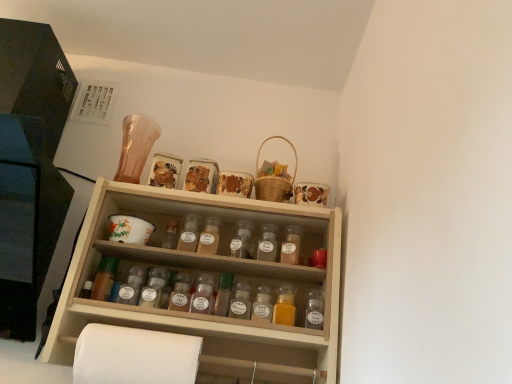
Measure the distance between point (38, 222) and camera.

The depth of point (38, 222) is 1.04 meters.

Measure the distance between white paper at lower left and camera.

white paper at lower left and camera are 35.61 inches apart.

Measure the distance between translucent plastic spice jar at center, which is the 4th bottle from left to right, and camera.

translucent plastic spice jar at center, which is the 4th bottle from left to right, and camera are 3.82 feet apart from each other.

Based on the photo, measure the distance between green glass bottle at center, placed as the first bottle when sorted from left to right, and camera.

The depth of green glass bottle at center, placed as the first bottle when sorted from left to right, is 3.46 feet.

You are a GUI agent. You are given a task and a screenshot of the screen. Output one action in this format:
    pyautogui.click(x=<x>, y=<y>)
    Task: Click on the woven brown basket at upper right
    The image size is (512, 384).
    Given the screenshot: What is the action you would take?
    pyautogui.click(x=274, y=180)

Is white paper at lower left facing towards translucent glass spice jar at center, which is the sixth bottle in right-to-left order?

No.

Is translucent glass spice jar at center, which is the sixth bottle in right-to-left order, completely or partially inside white paper at lower left?

No, translucent glass spice jar at center, which is the sixth bottle in right-to-left order, is located outside of white paper at lower left.

Consider the image. What's the angular difference between white paper at lower left and translucent glass spice jar at center, which is the sixth bottle in right-to-left order,'s facing directions?

The angular difference between white paper at lower left and translucent glass spice jar at center, which is the sixth bottle in right-to-left order, is 0.00209 degrees.

From a real-world perspective, does white paper at lower left stand above translucent glass spice jar at center, marked as the second bottle in a left-to-right arrangement?

Actually, white paper at lower left is physically below translucent glass spice jar at center, marked as the second bottle in a left-to-right arrangement, in the real world.

From a real-world perspective, is wooden spice rack at left under woven brown basket at upper right?

Yes, from a real-world perspective, wooden spice rack at left is below woven brown basket at upper right.

Is wooden spice rack at left not near woven brown basket at upper right?

wooden spice rack at left is near woven brown basket at upper right, not far away.

Which is in front, wooden spice rack at left or woven brown basket at upper right?

wooden spice rack at left is more forward.

In terms of height, does wooden spice rack at center look taller or shorter compared to translucent glass spice jar at center, the third bottle in the right-to-left sequence?

Considering their sizes, wooden spice rack at center has more height than translucent glass spice jar at center, the third bottle in the right-to-left sequence.

Is wooden spice rack at center situated inside translucent glass spice jar at center, the third bottle in the right-to-left sequence, or outside?

wooden spice rack at center cannot be found inside translucent glass spice jar at center, the third bottle in the right-to-left sequence.

Could you tell me if wooden spice rack at center is facing translucent glass spice jar at center, the fifth bottle positioned from the left?

Yes.

Locate an element on the screen. the 5th bottle behind the wooden spice rack at center, starting your count from the anchor is located at coordinates (267, 243).

From the image's perspective, which is below, translucent glass spice jar at center, the third bottle in the right-to-left sequence, or translucent plastic spice jar at center, positioned as the first bottle in right-to-left order?

translucent glass spice jar at center, the third bottle in the right-to-left sequence, is shown below in the image.

Is the surface of translucent glass spice jar at center, the third bottle in the right-to-left sequence, in direct contact with translucent plastic spice jar at center, positioned as the first bottle in right-to-left order?

Yes, translucent glass spice jar at center, the third bottle in the right-to-left sequence, is with translucent plastic spice jar at center, positioned as the first bottle in right-to-left order.

In the image, is translucent glass spice jar at center, the fifth bottle positioned from the left, positioned in front of or behind translucent plastic spice jar at center, positioned as the first bottle in right-to-left order?

translucent glass spice jar at center, the fifth bottle positioned from the left, is behind translucent plastic spice jar at center, positioned as the first bottle in right-to-left order.

Does translucent glass spice jar at center, the third bottle in the right-to-left sequence, have a greater width compared to translucent plastic spice jar at center, positioned as the first bottle in right-to-left order?

Incorrect, the width of translucent glass spice jar at center, the third bottle in the right-to-left sequence, does not surpass that of translucent plastic spice jar at center, positioned as the first bottle in right-to-left order.

You are a GUI agent. You are given a task and a screenshot of the screen. Output one action in this format:
    pyautogui.click(x=<x>, y=<y>)
    Task: Click on the 1st bottle counting from the left side of the translucent glass spice jar at center, the third bottle in the right-to-left sequence
    This screenshot has height=384, width=512.
    Given the screenshot: What is the action you would take?
    pyautogui.click(x=242, y=240)

Considering the relative positions of translucent plastic spice jar at center, which is the 4th bottle from left to right, and translucent glass spice jar at center, the third bottle in the right-to-left sequence, in the image provided, is translucent plastic spice jar at center, which is the 4th bottle from left to right, to the left or to the right of translucent glass spice jar at center, the third bottle in the right-to-left sequence,?

translucent plastic spice jar at center, which is the 4th bottle from left to right, is to the left of translucent glass spice jar at center, the third bottle in the right-to-left sequence.

Consider the image. Is translucent plastic spice jar at center, which is the 4th bottle from left to right, with translucent glass spice jar at center, the third bottle in the right-to-left sequence?

Yes, translucent plastic spice jar at center, which is the 4th bottle from left to right, is touching translucent glass spice jar at center, the third bottle in the right-to-left sequence.

Is green glass bottle at center, placed as the first bottle when sorted from left to right, positioned far away from wooden spice rack at left?

No, green glass bottle at center, placed as the first bottle when sorted from left to right, is in close proximity to wooden spice rack at left.

At what (x,y) coordinates should I click in order to perform the action: click on the 7th bottle positioned below the wooden spice rack at left (from a real-world perspective). Please return your answer as a coordinate pair (x, y). Looking at the image, I should click on (104, 278).

Is green glass bottle at center, the 7th bottle in the right-to-left sequence, situated inside wooden spice rack at left or outside?

green glass bottle at center, the 7th bottle in the right-to-left sequence, lies outside wooden spice rack at left.

Is point (250, 235) positioned behind point (214, 241)?

Yes, point (250, 235) is farther from viewer.

Is translucent glass spice jar at center, positioned as the 5th bottle in right-to-left order, at the back of translucent plastic spice jar at center, placed as the fourth bottle when sorted from right to left?

No.

Looking at this image, from the image's perspective, is translucent plastic spice jar at center, placed as the fourth bottle when sorted from right to left, located above or below translucent glass spice jar at center, positioned as the 5th bottle in right-to-left order?

Based on their image positions, translucent plastic spice jar at center, placed as the fourth bottle when sorted from right to left, is located beneath translucent glass spice jar at center, positioned as the 5th bottle in right-to-left order.

Is translucent plastic spice jar at center, which is the 4th bottle from left to right, next to translucent glass spice jar at center, which appears as the third bottle when viewed from the left, and touching it?

Yes, translucent plastic spice jar at center, which is the 4th bottle from left to right, and translucent glass spice jar at center, which appears as the third bottle when viewed from the left, clearly make contact.

Identify the location of paper towel below the translucent glass spice jar at center, marked as the second bottle in a left-to-right arrangement (from the image's perspective). (134, 356).

In order to click on basket located above the wooden spice rack at left (from a real-world perspective) in this screenshot , I will do `click(274, 180)`.

Estimate the real-world distances between objects in this image. Which object is further from woven brown basket at upper right, translucent plastic spice jar at center, which appears as the 7th bottle when viewed from the left, or translucent glass spice jar at center, the fifth bottle positioned from the left?

translucent plastic spice jar at center, which appears as the 7th bottle when viewed from the left, is further to woven brown basket at upper right.

When comparing their distances from translucent plastic bottle at center, acting as the 2th bottle starting from the right, does wooden spice rack at center or translucent plastic spice jar at center, positioned as the first bottle in right-to-left order, seem further?

Based on the image, wooden spice rack at center appears to be further to translucent plastic bottle at center, acting as the 2th bottle starting from the right.

From the image, which object appears to be nearer to translucent glass spice jar at center, which is the sixth bottle in right-to-left order, wooden spice rack at left or translucent plastic spice jar at center, which appears as the 7th bottle when viewed from the left?

The object closer to translucent glass spice jar at center, which is the sixth bottle in right-to-left order, is translucent plastic spice jar at center, which appears as the 7th bottle when viewed from the left.

From the image, which object appears to be farther from wooden spice rack at left, translucent plastic bottle at center, acting as the 2th bottle starting from the right, or wooden spice rack at center?

Based on the image, translucent plastic bottle at center, acting as the 2th bottle starting from the right, appears to be further to wooden spice rack at left.

From the image, which object appears to be nearer to translucent glass spice jar at center, marked as the second bottle in a left-to-right arrangement, wooden spice rack at center or translucent plastic bottle at center, acting as the 2th bottle starting from the right?

wooden spice rack at center is positioned closer to the anchor translucent glass spice jar at center, marked as the second bottle in a left-to-right arrangement.

Based on their spatial positions, is white paper at lower left or translucent glass spice jar at center, which appears as the third bottle when viewed from the left, closer to woven brown basket at upper right?

The object closer to woven brown basket at upper right is translucent glass spice jar at center, which appears as the third bottle when viewed from the left.

From the image, which object appears to be nearer to wooden spice rack at center, translucent plastic spice jar at center, which appears as the 7th bottle when viewed from the left, or translucent plastic spice jar at center, which is the 4th bottle from left to right?

Answer: The object closer to wooden spice rack at center is translucent plastic spice jar at center, which is the 4th bottle from left to right.

Which object lies nearer to the anchor point translucent glass spice jar at center, positioned as the 5th bottle in right-to-left order, wooden spice rack at center or translucent plastic spice jar at center, positioned as the first bottle in right-to-left order?

translucent plastic spice jar at center, positioned as the first bottle in right-to-left order, is positioned closer to the anchor translucent glass spice jar at center, positioned as the 5th bottle in right-to-left order.

Locate an element on the screen. The width and height of the screenshot is (512, 384). shelf between woven brown basket at upper right and white paper at lower left in the vertical direction is located at coordinates (215, 280).

You are a GUI agent. You are given a task and a screenshot of the screen. Output one action in this format:
    pyautogui.click(x=<x>, y=<y>)
    Task: Click on the basket situated between green glass bottle at center, placed as the first bottle when sorted from left to right, and translucent plastic bottle at center, which is the sixth bottle in left-to-right order, from left to right
    This screenshot has width=512, height=384.
    Given the screenshot: What is the action you would take?
    pyautogui.click(x=274, y=180)

Identify the location of shelf situated between green glass bottle at center, the 7th bottle in the right-to-left sequence, and translucent plastic spice jar at center, which is the 4th bottle from left to right, from left to right. (215, 280).

What are the coordinates of `paper towel between wooden spice rack at left and translucent glass spice jar at center, which is the sixth bottle in right-to-left order` in the screenshot? It's located at click(134, 356).